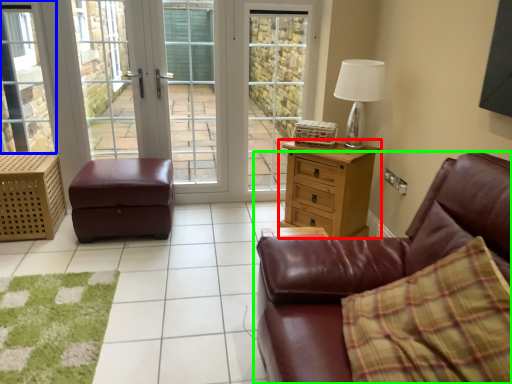
Question: Which is farther away from chest of drawers (highlighted by a red box)? window (highlighted by a blue box) or studio couch (highlighted by a green box)?

Choices:
 (A) window
 (B) studio couch

Answer: (A)